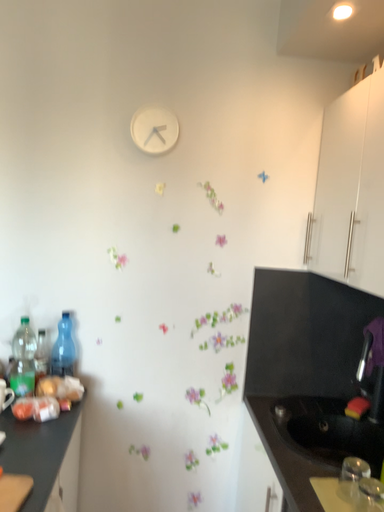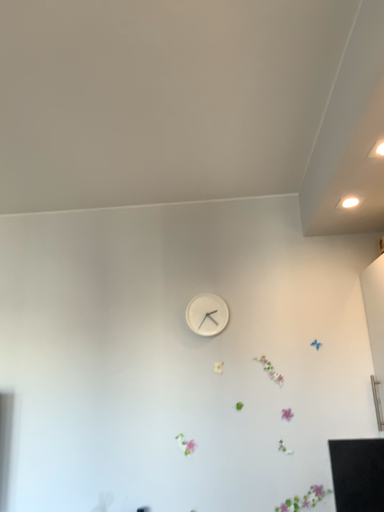
Question: Which way did the camera rotate in the video?

Choices:
 (A) rotated downward
 (B) rotated upward

Answer: (B)